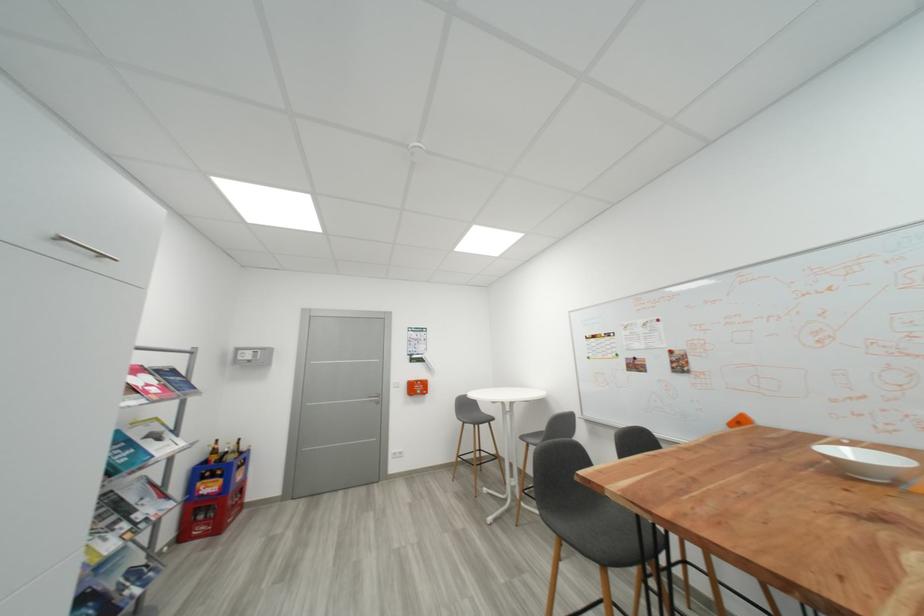
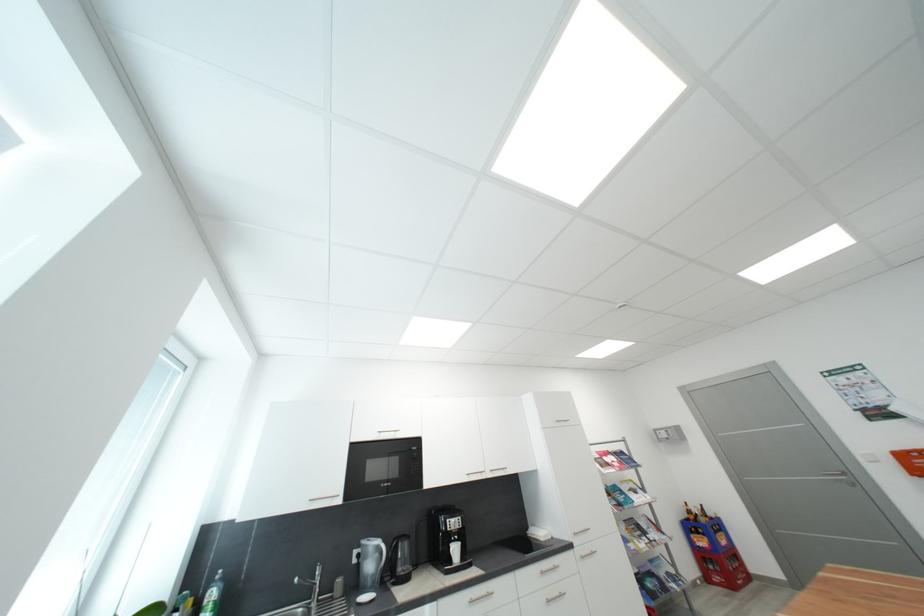
The point at (237, 459) is marked in the first image. Where is the corresponding point in the second image?

(710, 522)